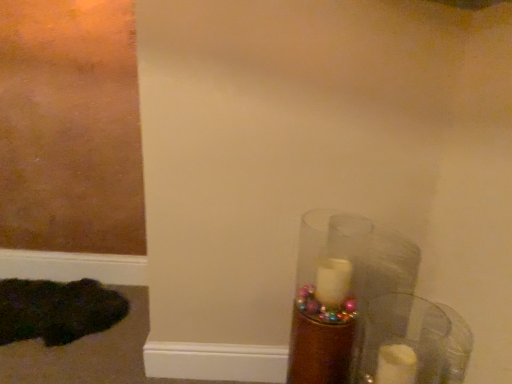
Find the location of a particular element. translucent glass candle at lower right is located at coordinates (323, 326).

Describe the element at coordinates (413, 342) in the screenshot. I see `transparent glass candle at right` at that location.

Where is `translucent glass candle at lower right`? Image resolution: width=512 pixels, height=384 pixels. translucent glass candle at lower right is located at coordinates (323, 326).

From a real-world perspective, between transparent glass candle at right and dark green fur at lower left, who is vertically lower?

From a 3D spatial view, dark green fur at lower left is below.

Looking at this image, is transparent glass candle at right smaller than dark green fur at lower left?

Indeed, transparent glass candle at right has a smaller size compared to dark green fur at lower left.

Can you tell me how much transparent glass candle at right and dark green fur at lower left differ in facing direction?

They differ by 1.32 degrees in their facing directions.

Is transparent glass candle at right shorter than dark green fur at lower left?

No.

Is dark green fur at lower left closer to camera compared to transparent glass candle at right?

No.

Based on the photo, could you tell me if dark green fur at lower left is turned towards transparent glass candle at right?

No, dark green fur at lower left is not aimed at transparent glass candle at right.

At what (x,y) coordinates should I click in order to perform the action: click on glass vase on the right of dark green fur at lower left. Please return your answer as a coordinate pair (x, y). Image resolution: width=512 pixels, height=384 pixels. Looking at the image, I should click on (413, 342).

Is translucent glass candle at lower right to the right of dark green fur at lower left from the viewer's perspective?

Correct, you'll find translucent glass candle at lower right to the right of dark green fur at lower left.

Between translucent glass candle at lower right and dark green fur at lower left, which one has less height?

Standing shorter between the two is dark green fur at lower left.

Is dark green fur at lower left at the back of translucent glass candle at lower right?

Answer: No, translucent glass candle at lower right's orientation is not away from dark green fur at lower left.

Choose the correct answer: Is translucent glass candle at lower right inside transparent glass candle at right or outside it?

translucent glass candle at lower right is not enclosed by transparent glass candle at right.

Which object is thinner, translucent glass candle at lower right or transparent glass candle at right?

transparent glass candle at right.

Can you confirm if translucent glass candle at lower right is taller than transparent glass candle at right?

Indeed, translucent glass candle at lower right has a greater height compared to transparent glass candle at right.

Is transparent glass candle at right not inside translucent glass candle at lower right?

transparent glass candle at right lies outside translucent glass candle at lower right's area.

I want to click on candle holder above the transparent glass candle at right (from the image's perspective), so click(x=323, y=326).

Is transparent glass candle at right far away from translucent glass candle at lower right?

transparent glass candle at right is actually quite close to translucent glass candle at lower right.

Considering the relative sizes of transparent glass candle at right and translucent glass candle at lower right in the image provided, is transparent glass candle at right bigger than translucent glass candle at lower right?

No.

Between dark green fur at lower left and translucent glass candle at lower right, which one appears on the right side from the viewer's perspective?

translucent glass candle at lower right is more to the right.

Find the location of a particular element. candle holder on the right of dark green fur at lower left is located at coordinates (323, 326).

Is dark green fur at lower left further to camera compared to translucent glass candle at lower right?

Yes, it is.

Identify the location of glass vase above the dark green fur at lower left (from the image's perspective). This screenshot has width=512, height=384. (413, 342).

Locate an element on the screen. The image size is (512, 384). animal directly beneath the transparent glass candle at right (from a real-world perspective) is located at coordinates (57, 310).

Considering their positions, is transparent glass candle at right positioned further to translucent glass candle at lower right than dark green fur at lower left?

dark green fur at lower left is further to translucent glass candle at lower right.

When comparing their distances from dark green fur at lower left, does translucent glass candle at lower right or transparent glass candle at right seem closer?

The object closer to dark green fur at lower left is translucent glass candle at lower right.

Which object lies further to the anchor point dark green fur at lower left, transparent glass candle at right or translucent glass candle at lower right?

transparent glass candle at right is positioned further to the anchor dark green fur at lower left.

Estimate the real-world distances between objects in this image. Which object is closer to transparent glass candle at right, translucent glass candle at lower right or dark green fur at lower left?

Among the two, translucent glass candle at lower right is located nearer to transparent glass candle at right.

From the image, which object appears to be nearer to transparent glass candle at right, dark green fur at lower left or translucent glass candle at lower right?

The object closer to transparent glass candle at right is translucent glass candle at lower right.

Estimate the real-world distances between objects in this image. Which object is closer to translucent glass candle at lower right, dark green fur at lower left or transparent glass candle at right?

transparent glass candle at right is closer to translucent glass candle at lower right.

At what (x,y) coordinates should I click in order to perform the action: click on candle holder located between dark green fur at lower left and transparent glass candle at right in the left-right direction. Please return your answer as a coordinate pair (x, y). Looking at the image, I should click on (323, 326).